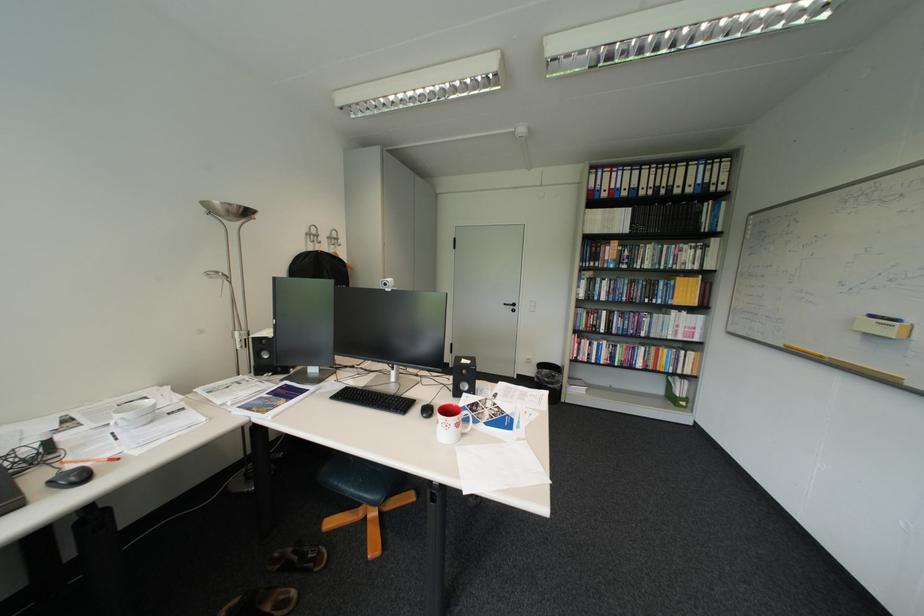
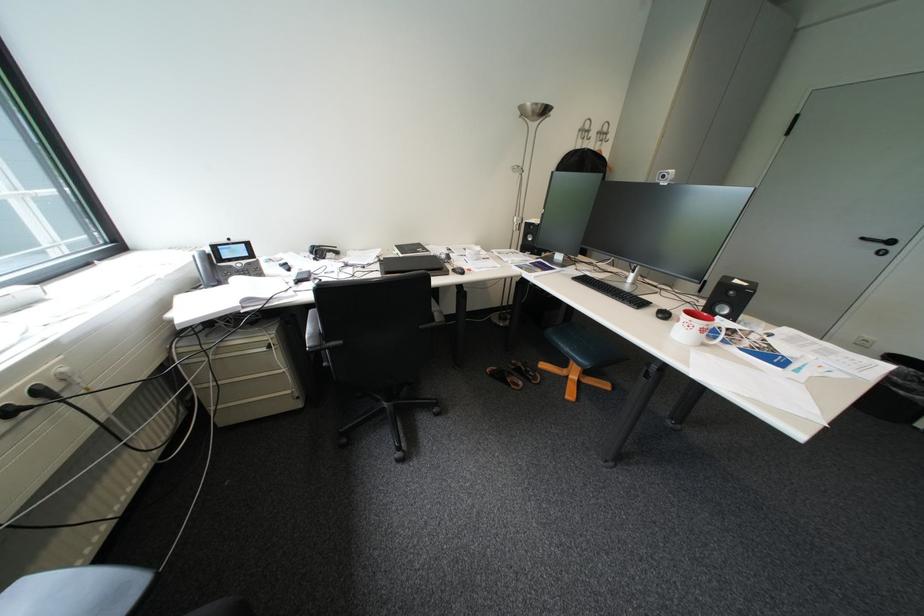
Where in the second image is the point corresponding to [347,484] from the first image?

(569, 341)